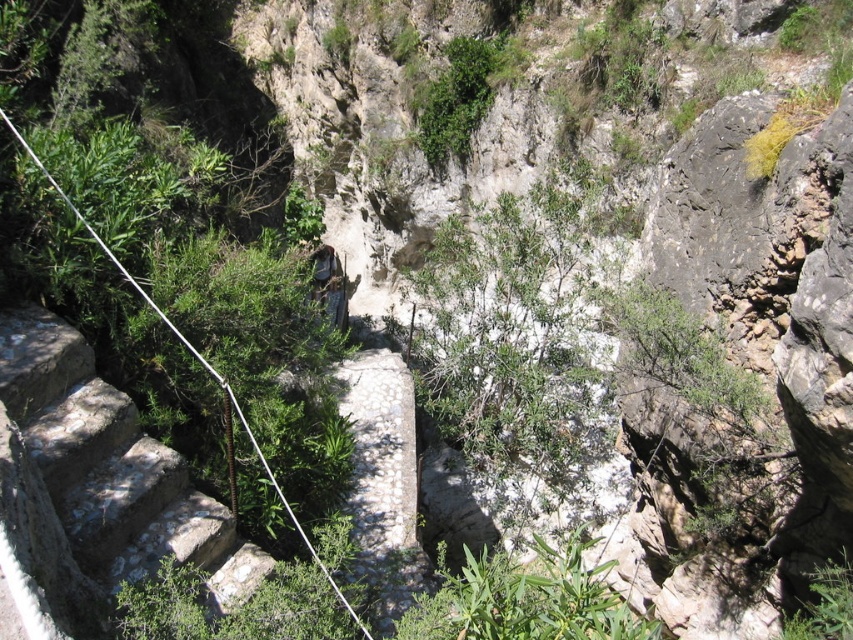
You are a hiker carrying a backpack and need to navigate the stone stairs at left. You notice a green leafy bush at upper center nearby. Which object is narrower in width?

The stone stairs at left are narrower in width compared to the green leafy bush at upper center.

You are a hiker planning to climb the stone stairs at left and pass by the green leafy bush at upper center. Which one is shorter in height?

The stone stairs at left are shorter in height compared to the green leafy bush at upper center.